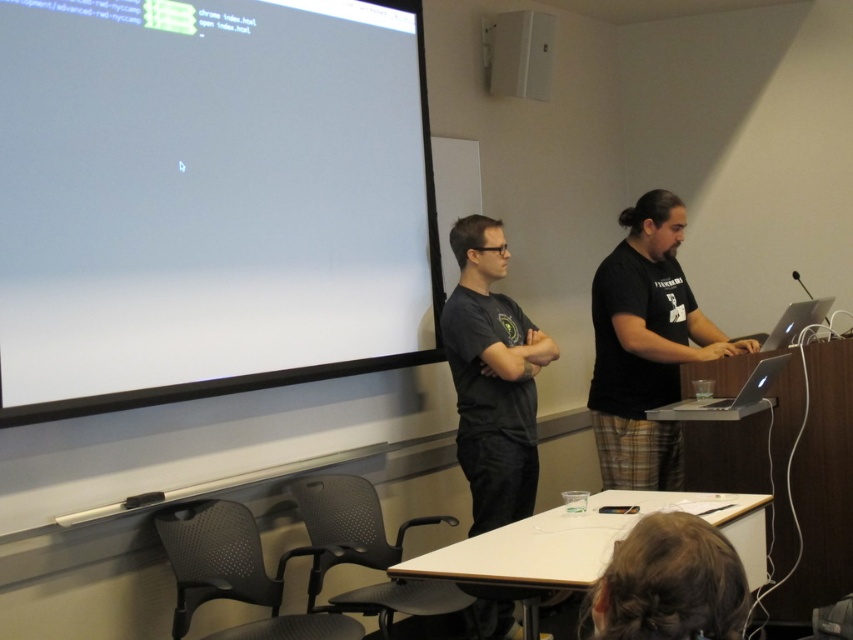
Question: Which point is closer to the camera taking this photo?

Choices:
 (A) 550,38
 (B) 602,269
 (C) 747,593
 (D) 335,28

Answer: (C)

Question: Among these objects, which one is farthest from the camera?

Choices:
 (A) white plastic speaker at upper center
 (B) black matte shirt at right

Answer: (A)

Question: Can you confirm if brown hair at lower center is bigger than white plastic speaker at upper center?

Choices:
 (A) no
 (B) yes

Answer: (A)

Question: Does black matte shirt at right have a smaller size compared to brown hair at lower center?

Choices:
 (A) no
 (B) yes

Answer: (A)

Question: Estimate the real-world distances between objects in this image. Which object is farther from the white glossy projection screen at upper left?

Choices:
 (A) brown hair at lower center
 (B) white plastic speaker at upper center
 (C) black matte shirt at right

Answer: (A)

Question: From the image, what is the correct spatial relationship of white glossy projection screen at upper left in relation to brown hair at lower center?

Choices:
 (A) below
 (B) above

Answer: (B)